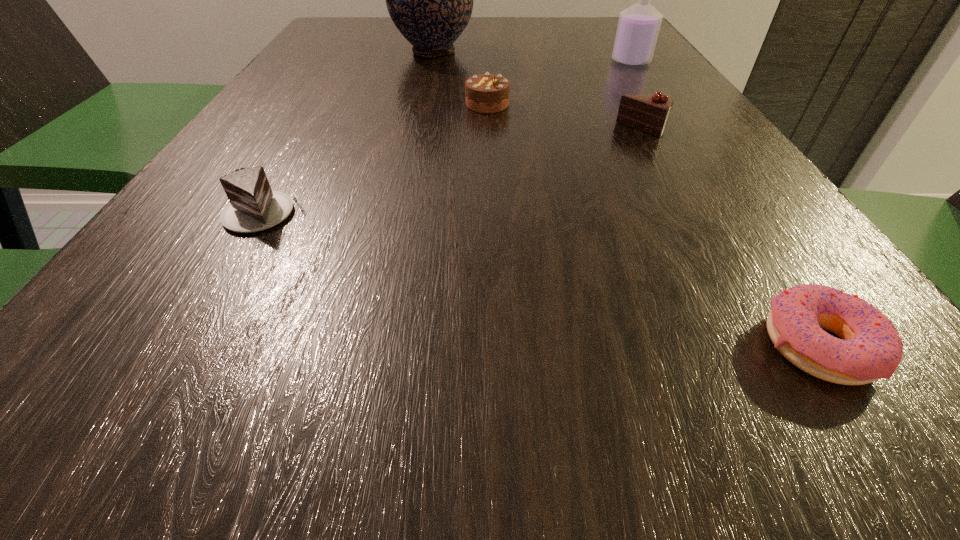
Find the location of a particular element. The width and height of the screenshot is (960, 540). free spot between the second nearest chocolate cake and the doughnut is located at coordinates (732, 237).

Where is `free space that is in between the doughnut and the leftmost chocolate cake`? The image size is (960, 540). free space that is in between the doughnut and the leftmost chocolate cake is located at coordinates (541, 279).

This screenshot has height=540, width=960. Find the location of `vacant space that's between the second chocolate cake from left to right and the perfume`. vacant space that's between the second chocolate cake from left to right and the perfume is located at coordinates (559, 83).

Image resolution: width=960 pixels, height=540 pixels. I want to click on vacant area that lies between the second nearest chocolate cake and the farthest chocolate cake, so click(x=565, y=117).

What are the coordinates of `vacant area that lies between the doughnut and the tallest object` in the screenshot? It's located at (626, 198).

The height and width of the screenshot is (540, 960). I want to click on free space between the leftmost chocolate cake and the third nearest object, so click(x=454, y=171).

The height and width of the screenshot is (540, 960). I want to click on vacant area between the second nearest object and the second nearest chocolate cake, so click(454, 171).

I want to click on unoccupied position between the shortest object and the leftmost object, so click(x=541, y=279).

In order to click on object that stands as the fourth closest to the third farthest object in this screenshot , I will do `click(253, 206)`.

In order to click on the fourth closest object to the fourth farthest object in this screenshot , I will do `click(870, 348)`.